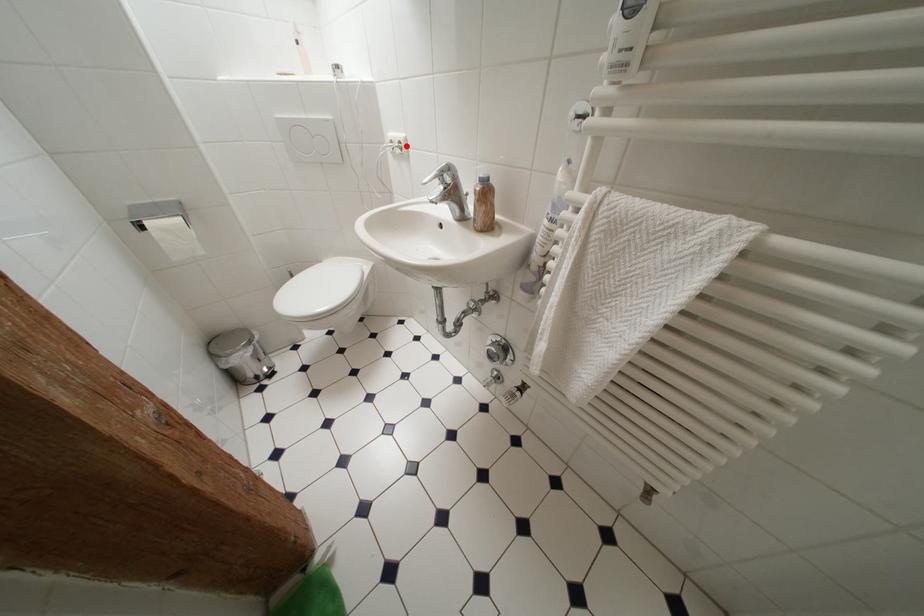
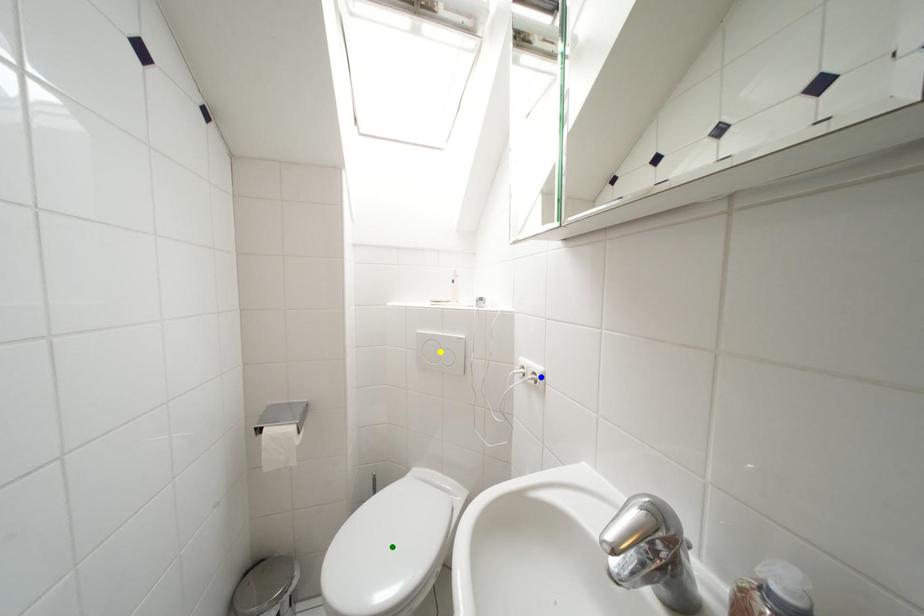
Question: I am providing you with two images of the same scene from different viewpoints. A red point is marked on the first image. You are given multiple points on the second image. Which point in image 2 is actually the same real-world point as the red point in image 1?

Choices:
 (A) green point
 (B) yellow point
 (C) blue point

Answer: (C)